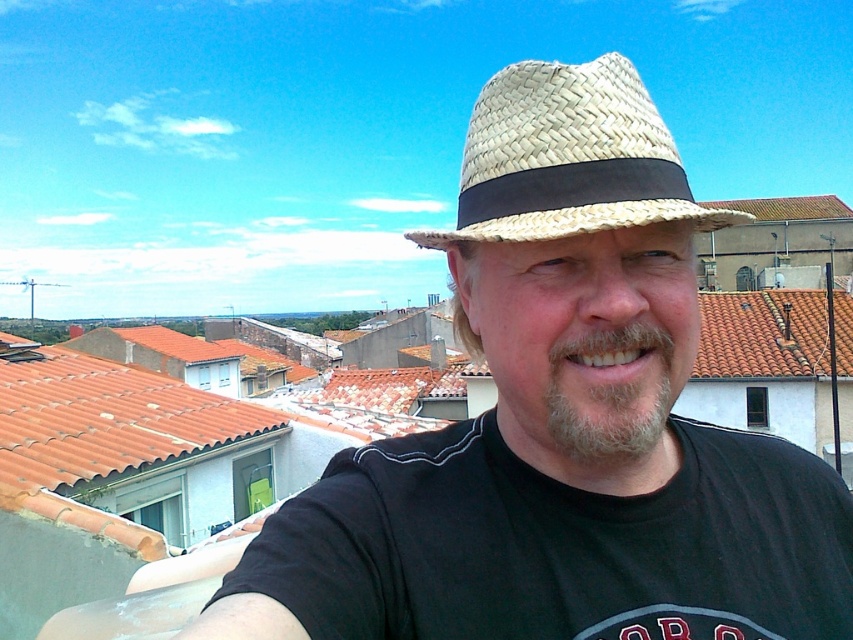
Question: Among these points, which one is farthest from the camera?

Choices:
 (A) (550, 168)
 (B) (357, 497)

Answer: (B)

Question: Observing the image, what is the correct spatial positioning of woven straw hat at center in reference to woven straw hat at upper center?

Choices:
 (A) above
 (B) below

Answer: (B)

Question: Is woven straw hat at center to the left of woven straw hat at upper center from the viewer's perspective?

Choices:
 (A) yes
 (B) no

Answer: (A)

Question: Among these objects, which one is farthest from the camera?

Choices:
 (A) woven straw hat at center
 (B) woven straw hat at upper center

Answer: (A)

Question: Is woven straw hat at center bigger than woven straw hat at upper center?

Choices:
 (A) yes
 (B) no

Answer: (B)